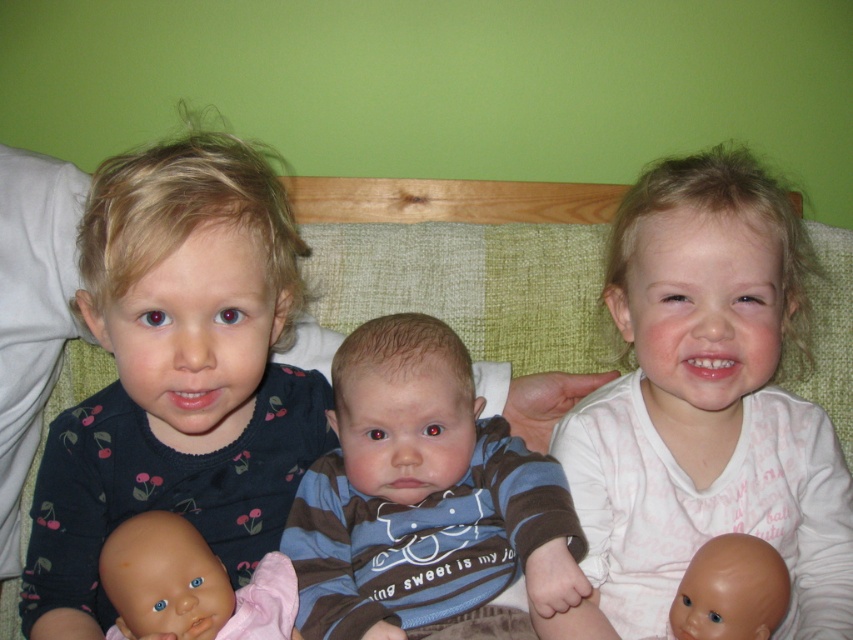
Who is taller, smooth plastic doll at lower left or smooth plastic doll at lower right?

Standing taller between the two is smooth plastic doll at lower left.

Does smooth plastic doll at lower left have a greater height compared to smooth plastic doll at lower right?

Indeed, smooth plastic doll at lower left has a greater height compared to smooth plastic doll at lower right.

The height and width of the screenshot is (640, 853). I want to click on smooth plastic doll at lower left, so click(189, 586).

Who is lower down, white soft fabric at upper right or smooth plastic doll at lower left?

smooth plastic doll at lower left

Can you confirm if white soft fabric at upper right is smaller than smooth plastic doll at lower left?

Actually, white soft fabric at upper right might be larger than smooth plastic doll at lower left.

The width and height of the screenshot is (853, 640). Describe the element at coordinates (706, 401) in the screenshot. I see `white soft fabric at upper right` at that location.

This screenshot has width=853, height=640. In order to click on white soft fabric at upper right in this screenshot , I will do `click(706, 401)`.

How far apart are dark blue jersey at left and striped cotton shirt at center?

dark blue jersey at left and striped cotton shirt at center are 5.40 inches apart from each other.

Does point (221, 172) lie in front of point (322, 458)?

Yes, it is in front of point (322, 458).

Who is more forward, (x=97, y=396) or (x=393, y=465)?

Point (x=393, y=465) is in front.

The height and width of the screenshot is (640, 853). In order to click on dark blue jersey at left in this screenshot , I will do `click(178, 369)`.